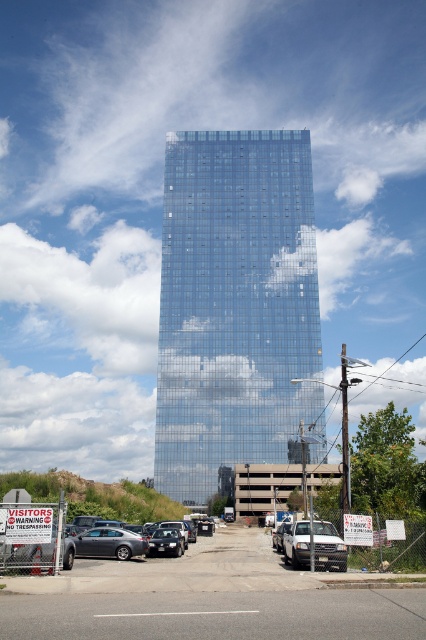
Between matte gray sedan at center and satin silver car at lower left, which one is positioned lower?

matte gray sedan at center is lower down.

Is matte gray sedan at center positioned in front of satin silver car at lower left?

Yes, matte gray sedan at center is in front of satin silver car at lower left.

Describe the element at coordinates (132, 540) in the screenshot. The height and width of the screenshot is (640, 426). I see `matte gray sedan at center` at that location.

Find the location of `matte gray sedan at center`. matte gray sedan at center is located at coordinates (132, 540).

Which of these two, matte gray sedan at center or satin black sedan at center, stands taller?

matte gray sedan at center is taller.

Is matte gray sedan at center bigger than satin black sedan at center?

Correct, matte gray sedan at center is larger in size than satin black sedan at center.

The width and height of the screenshot is (426, 640). Find the location of `matte gray sedan at center`. matte gray sedan at center is located at coordinates (132, 540).

Measure the distance between gray asphalt parking lot at lower center and satin black sedan at center.

gray asphalt parking lot at lower center and satin black sedan at center are 8.64 meters apart.

This screenshot has width=426, height=640. What do you see at coordinates (212, 598) in the screenshot?
I see `gray asphalt parking lot at lower center` at bounding box center [212, 598].

Is point (132, 582) closer to viewer compared to point (181, 538)?

Yes, it is.

Where is `gray asphalt parking lot at lower center`? gray asphalt parking lot at lower center is located at coordinates (212, 598).